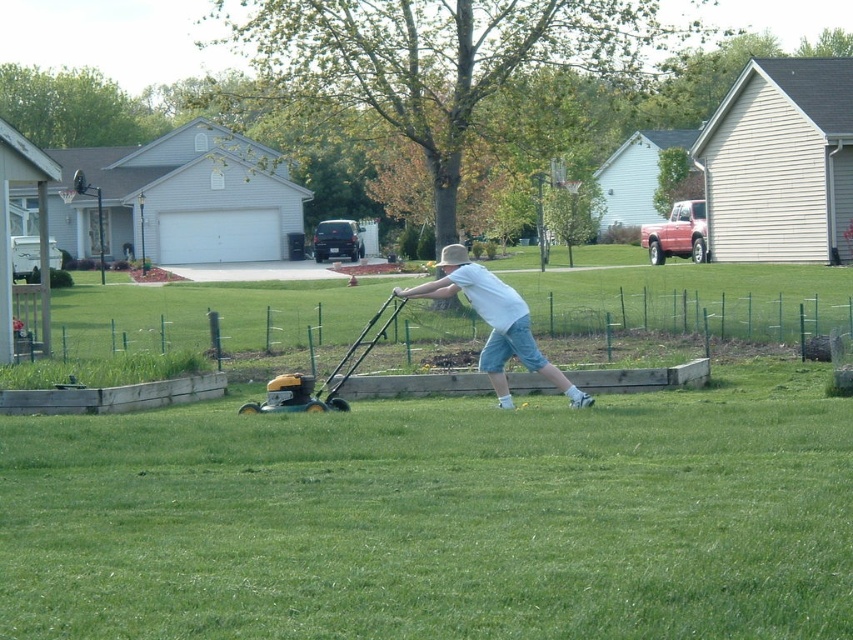
Question: Which object appears farthest from the camera in this image?

Choices:
 (A) green grass at center
 (B) white cotton shirt at center

Answer: (B)

Question: Can you confirm if green grass at center is smaller than white cotton shirt at center?

Choices:
 (A) yes
 (B) no

Answer: (B)

Question: Which point appears farthest from the camera in this image?

Choices:
 (A) (825, 518)
 (B) (451, 269)

Answer: (B)

Question: Is green grass at center bigger than white cotton shirt at center?

Choices:
 (A) no
 (B) yes

Answer: (B)

Question: Which point is farther from the camera taking this photo?

Choices:
 (A) (288, 634)
 (B) (413, 288)

Answer: (B)

Question: Is green grass at center thinner than white cotton shirt at center?

Choices:
 (A) yes
 (B) no

Answer: (B)